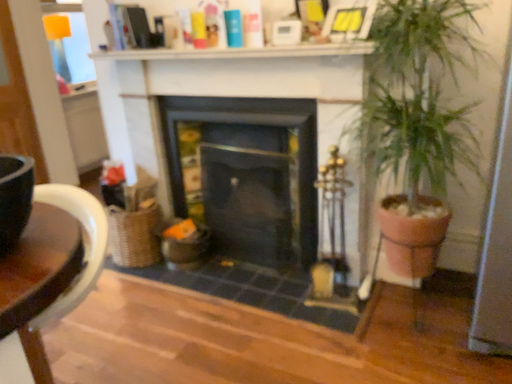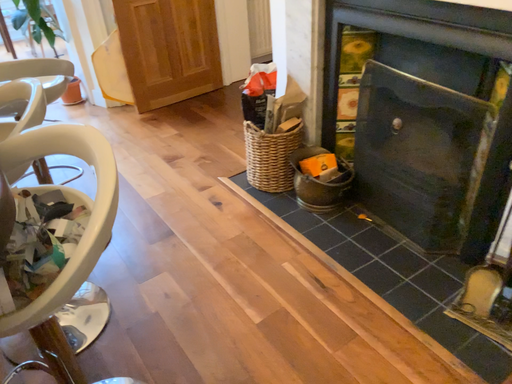
Question: How did the camera likely rotate when shooting the video?

Choices:
 (A) rotated left
 (B) rotated right

Answer: (A)